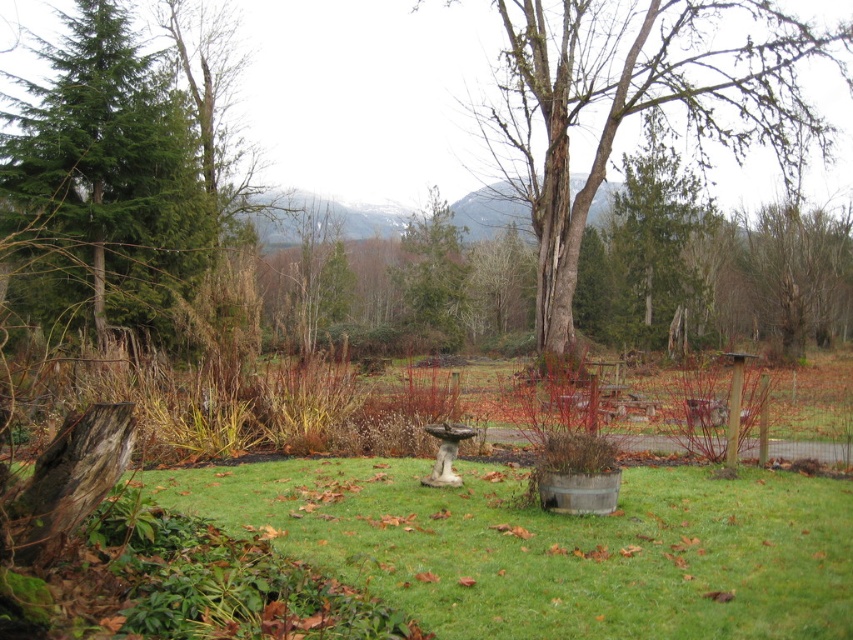
You are standing in the garden and want to take a photo of both the green rough bark tree at center and the green textured evergreen tree at center. Which tree should you focus on first if you want to capture both in the same frame without moving your camera?

The green rough bark tree at center is above the green textured evergreen tree at center, so you should focus on the green textured evergreen tree at center first to ensure both are in the frame.